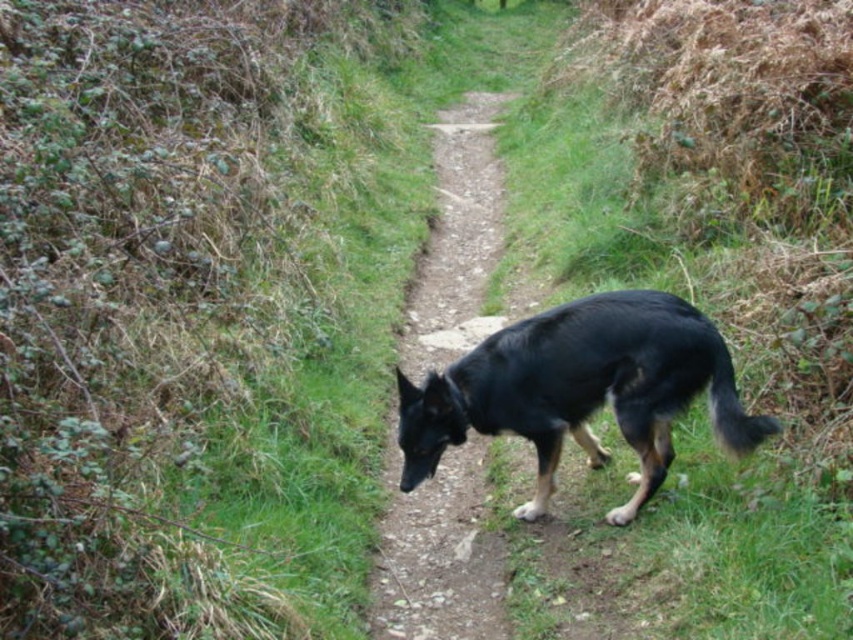
Question: Which of the following is the farthest from the observer?

Choices:
 (A) black glossy dog at center
 (B) dirt path at center

Answer: (B)

Question: Is black glossy dog at center to the left of dirt path at center from the viewer's perspective?

Choices:
 (A) no
 (B) yes

Answer: (A)

Question: Can you confirm if black glossy dog at center is smaller than dirt path at center?

Choices:
 (A) no
 (B) yes

Answer: (B)

Question: Can you confirm if black glossy dog at center is positioned above dirt path at center?

Choices:
 (A) no
 (B) yes

Answer: (A)

Question: Which of the following is the closest to the observer?

Choices:
 (A) (476, 515)
 (B) (625, 516)

Answer: (B)